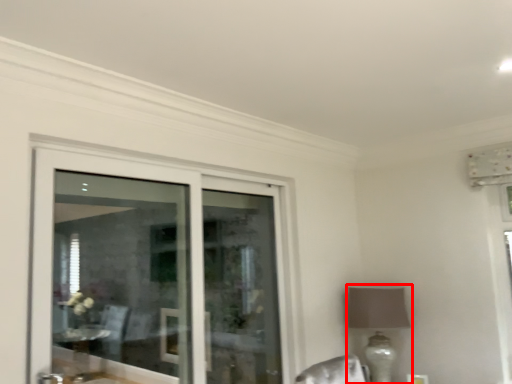
Question: From the image, what is the correct spatial relationship of table lamp (annotated by the red box) in relation to door?

Choices:
 (A) left
 (B) right

Answer: (B)